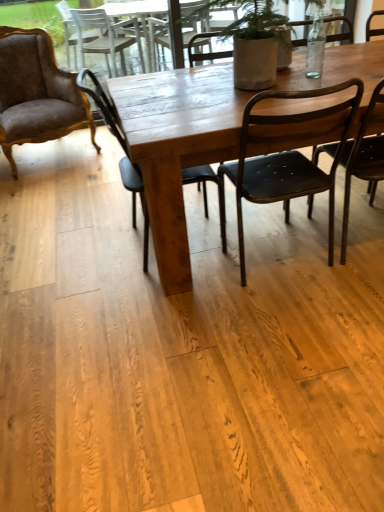
Find the location of a particular element. Image resolution: width=384 pixels, height=512 pixels. vacant space to the left of matte black chair at center, the 3th chair viewed from the right is located at coordinates (79, 264).